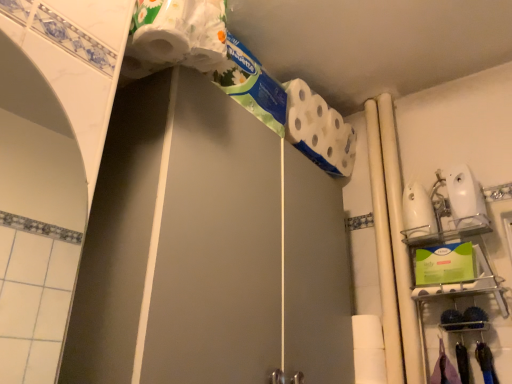
Question: Does white matte pipe at center right, the 1th beam in the left-to-right sequence, have a lesser height compared to white glossy beam at right, which ranks as the first beam in right-to-left order?

Choices:
 (A) yes
 (B) no

Answer: (B)

Question: From the image's perspective, is white matte pipe at center right, positioned as the 2th beam in right-to-left order, located above white glossy beam at right, which ranks as the first beam in right-to-left order?

Choices:
 (A) yes
 (B) no

Answer: (B)

Question: Is white matte pipe at center right, positioned as the 2th beam in right-to-left order, outside of white glossy beam at right, acting as the second beam starting from the left?

Choices:
 (A) yes
 (B) no

Answer: (A)

Question: Does white matte pipe at center right, positioned as the 2th beam in right-to-left order, come in front of white glossy beam at right, acting as the second beam starting from the left?

Choices:
 (A) no
 (B) yes

Answer: (A)

Question: Considering the relative positions of white matte pipe at center right, the 1th beam in the left-to-right sequence, and white glossy beam at right, which ranks as the first beam in right-to-left order, in the image provided, is white matte pipe at center right, the 1th beam in the left-to-right sequence, to the right of white glossy beam at right, which ranks as the first beam in right-to-left order, from the viewer's perspective?

Choices:
 (A) no
 (B) yes

Answer: (A)

Question: From the image's perspective, is white matte pipe at center right, positioned as the 2th beam in right-to-left order, positioned above or below white matte toilet paper at upper center?

Choices:
 (A) below
 (B) above

Answer: (A)

Question: From their relative heights in the image, would you say white matte pipe at center right, positioned as the 2th beam in right-to-left order, is taller or shorter than white matte toilet paper at upper center?

Choices:
 (A) tall
 (B) short

Answer: (A)

Question: Considering the relative positions of white matte pipe at center right, the 1th beam in the left-to-right sequence, and white matte toilet paper at upper center in the image provided, is white matte pipe at center right, the 1th beam in the left-to-right sequence, to the left or to the right of white matte toilet paper at upper center?

Choices:
 (A) right
 (B) left

Answer: (A)

Question: From a real-world perspective, is white matte pipe at center right, positioned as the 2th beam in right-to-left order, physically located above or below white matte toilet paper at upper center?

Choices:
 (A) above
 (B) below

Answer: (B)

Question: Is white glossy beam at right, which ranks as the first beam in right-to-left order, situated inside white matte pipe at center right, positioned as the 2th beam in right-to-left order, or outside?

Choices:
 (A) outside
 (B) inside

Answer: (A)

Question: Is white glossy beam at right, acting as the second beam starting from the left, in front of or behind white matte pipe at center right, positioned as the 2th beam in right-to-left order, in the image?

Choices:
 (A) front
 (B) behind

Answer: (A)

Question: Is white glossy beam at right, which ranks as the first beam in right-to-left order, taller or shorter than white matte pipe at center right, the 1th beam in the left-to-right sequence?

Choices:
 (A) short
 (B) tall

Answer: (A)

Question: From a real-world perspective, is white glossy beam at right, acting as the second beam starting from the left, physically located above or below white matte pipe at center right, the 1th beam in the left-to-right sequence?

Choices:
 (A) above
 (B) below

Answer: (A)

Question: From a real-world perspective, is white glossy screen door at upper center physically located above or below white matte toilet paper at upper center?

Choices:
 (A) below
 (B) above

Answer: (A)

Question: Considering the positions of white glossy screen door at upper center and white matte toilet paper at upper center in the image, is white glossy screen door at upper center wider or thinner than white matte toilet paper at upper center?

Choices:
 (A) wide
 (B) thin

Answer: (A)